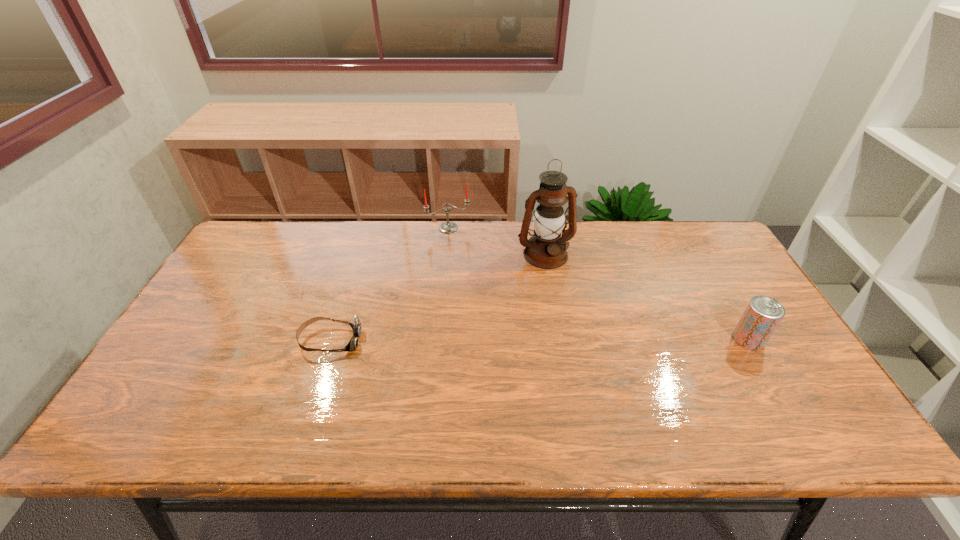
You are a GUI agent. You are given a task and a screenshot of the screen. Output one action in this format:
    pyautogui.click(x=<x>, y=<y>)
    Task: Click on the free region located 0.310m on the side of the third object from left to right, there is a wick adjustment knob
    This screenshot has width=960, height=540.
    Given the screenshot: What is the action you would take?
    pyautogui.click(x=593, y=345)

Identify the location of vacant space located 0.070m on the side of the third object from left to right, there is a wick adjustment knob. (562, 284).

At what (x,y) coordinates should I click in order to perform the action: click on vacant space located 0.280m on the side of the third object from left to right, there is a wick adjustment knob. Please return your answer as a coordinate pair (x, y). This screenshot has height=540, width=960. Looking at the image, I should click on click(589, 336).

This screenshot has width=960, height=540. Find the location of `vacant space situated on the front-facing side of the farthest object`. vacant space situated on the front-facing side of the farthest object is located at coordinates (481, 293).

Where is `vacant space situated 0.190m on the front-facing side of the farthest object`? vacant space situated 0.190m on the front-facing side of the farthest object is located at coordinates (469, 268).

Locate an element on the screen. This screenshot has height=540, width=960. vacant space located on the front-facing side of the farthest object is located at coordinates (468, 264).

Where is `lantern at the far edge`? The image size is (960, 540). lantern at the far edge is located at coordinates (546, 249).

Locate an element on the screen. This screenshot has height=540, width=960. candle present at the far edge is located at coordinates (447, 227).

The image size is (960, 540). Find the location of `object that is at the right edge`. object that is at the right edge is located at coordinates (763, 314).

At what (x,y) coordinates should I click in order to perform the action: click on vacant space at the far edge. Please return your answer as a coordinate pair (x, y). Looking at the image, I should click on (302, 258).